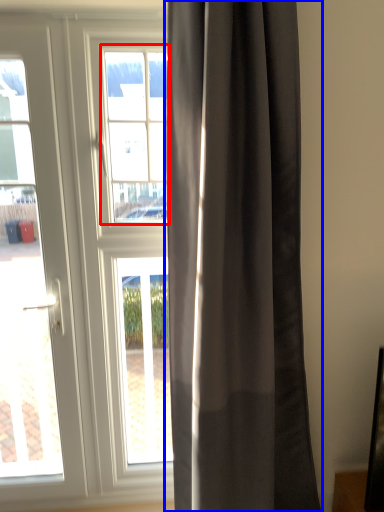
Question: Which of the following is the closest to the observer, bay window (highlighted by a red box) or curtain (highlighted by a blue box)?

Choices:
 (A) bay window
 (B) curtain

Answer: (B)